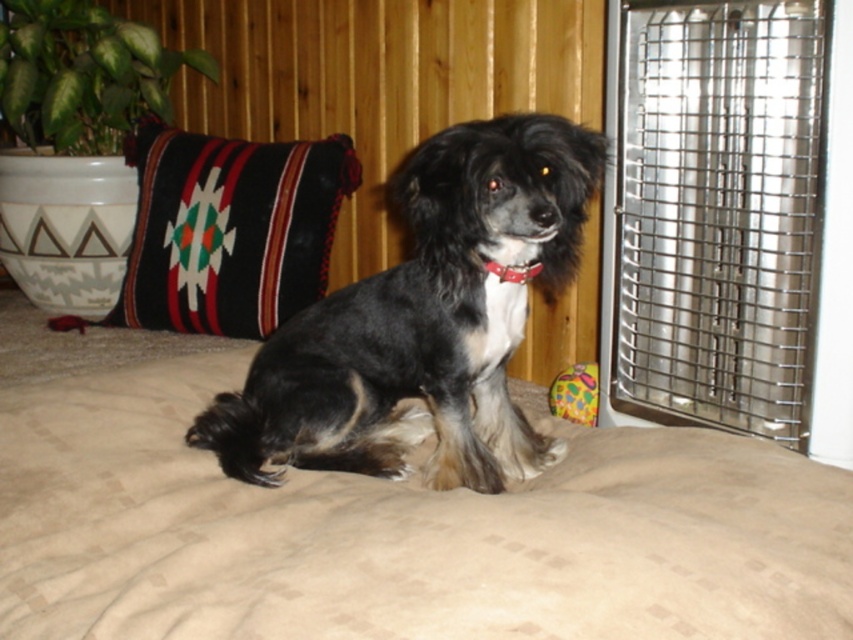
Does beige fabric dog bed at center appear over black woven pillow at upper left?

Incorrect, beige fabric dog bed at center is not positioned above black woven pillow at upper left.

Can you confirm if beige fabric dog bed at center is positioned to the right of black woven pillow at upper left?

Indeed, beige fabric dog bed at center is positioned on the right side of black woven pillow at upper left.

Describe the element at coordinates (399, 531) in the screenshot. I see `beige fabric dog bed at center` at that location.

I want to click on beige fabric dog bed at center, so click(x=399, y=531).

Can you confirm if metallic grid heater at right is taller than red leather collar at center?

Yes, metallic grid heater at right is taller than red leather collar at center.

Between metallic grid heater at right and red leather collar at center, which one appears on the right side from the viewer's perspective?

From the viewer's perspective, metallic grid heater at right appears more on the right side.

Does point (688, 396) come farther from viewer compared to point (527, 280)?

Yes, point (688, 396) is farther from viewer.

The image size is (853, 640). What are the coordinates of `metallic grid heater at right` in the screenshot? It's located at (730, 218).

The height and width of the screenshot is (640, 853). What do you see at coordinates (399, 531) in the screenshot? I see `beige fabric dog bed at center` at bounding box center [399, 531].

Is beige fabric dog bed at center to the right of black fur dog at center from the viewer's perspective?

In fact, beige fabric dog bed at center is to the left of black fur dog at center.

In order to click on beige fabric dog bed at center in this screenshot , I will do `click(399, 531)`.